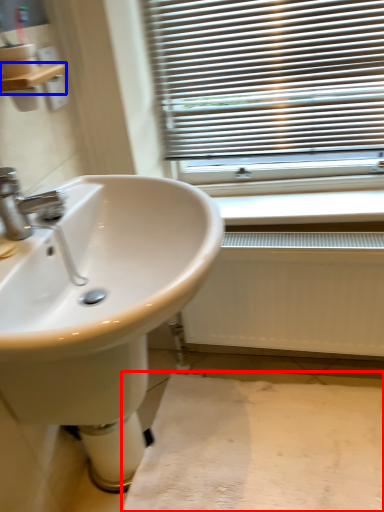
Question: Which object is further to the camera taking this photo, plain (highlighted by a red box) or balustrade (highlighted by a blue box)?

Choices:
 (A) plain
 (B) balustrade

Answer: (A)